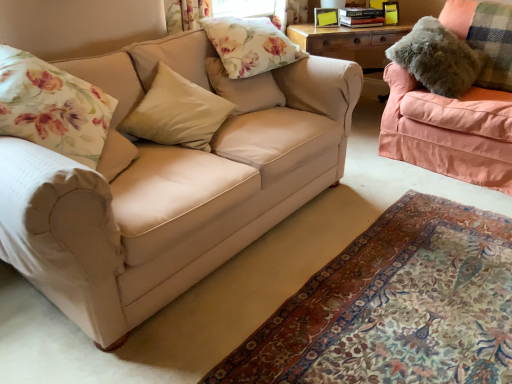
The height and width of the screenshot is (384, 512). What are the coordinates of `floral fabric pillow at upper center, marked as the second pillow in a right-to-left arrangement` in the screenshot? It's located at (244, 88).

In order to face beige fabric pillow at center, the third pillow in the right-to-left sequence, should I rotate leftwards or rightwards?

A 9.986 degree turn to the left will do.

What do you see at coordinates (395, 306) in the screenshot? The width and height of the screenshot is (512, 384). I see `beige fabric rug at lower center` at bounding box center [395, 306].

Where is `beige fabric couch at left, positioned as the first studio couch in left-to-right order`? beige fabric couch at left, positioned as the first studio couch in left-to-right order is located at coordinates (170, 201).

Is floral fabric pillow at left, placed as the fourth pillow when sorted from right to left, located within fuzzy gray pillow at upper right, acting as the first pillow starting from the right?

Actually, floral fabric pillow at left, placed as the fourth pillow when sorted from right to left, is outside fuzzy gray pillow at upper right, acting as the first pillow starting from the right.

Between fuzzy gray pillow at upper right, acting as the first pillow starting from the right, and floral fabric pillow at left, placed as the fourth pillow when sorted from right to left, which one has smaller size?

With smaller size is fuzzy gray pillow at upper right, acting as the first pillow starting from the right.

Which is more to the left, fuzzy gray pillow at upper right, acting as the first pillow starting from the right, or floral fabric pillow at left, placed as the first pillow when sorted from left to right?

Positioned to the left is floral fabric pillow at left, placed as the first pillow when sorted from left to right.

Consider the image. Is beige fabric couch at left, which appears as the 2th studio couch when viewed from the right, located outside floral fabric pillow at upper center?

That's correct, beige fabric couch at left, which appears as the 2th studio couch when viewed from the right, is outside of floral fabric pillow at upper center.

Does point (192, 36) lie in front of point (202, 20)?

Yes.

Can you confirm if beige fabric couch at left, which appears as the 2th studio couch when viewed from the right, is thinner than floral fabric pillow at upper center?

In fact, beige fabric couch at left, which appears as the 2th studio couch when viewed from the right, might be wider than floral fabric pillow at upper center.

From the image's perspective, who appears lower, beige fabric couch at left, positioned as the first studio couch in left-to-right order, or floral fabric pillow at upper center?

beige fabric couch at left, positioned as the first studio couch in left-to-right order.

Are beige fabric pillow at center, which is counted as the 2th pillow, starting from the left, and fuzzy gray pillow at upper right, arranged as the 4th pillow when viewed from the left, far apart?

Yes.

Is beige fabric pillow at center, the third pillow in the right-to-left sequence, further to camera compared to fuzzy gray pillow at upper right, acting as the first pillow starting from the right?

No, beige fabric pillow at center, the third pillow in the right-to-left sequence, is in front of fuzzy gray pillow at upper right, acting as the first pillow starting from the right.

How far apart are beige fabric pillow at center, the third pillow in the right-to-left sequence, and fuzzy gray pillow at upper right, arranged as the 4th pillow when viewed from the left?

The distance of beige fabric pillow at center, the third pillow in the right-to-left sequence, from fuzzy gray pillow at upper right, arranged as the 4th pillow when viewed from the left, is 1.48 meters.

Identify the location of the 2nd pillow behind the beige fabric pillow at center, which is counted as the 2th pillow, starting from the left. (437, 58).

Are pink fabric couch at right, which is counted as the 2th studio couch, starting from the left, and fuzzy gray pillow at upper right, arranged as the 4th pillow when viewed from the left, far apart?

No.

Does pink fabric couch at right, the first studio couch when ordered from right to left, have a greater width compared to fuzzy gray pillow at upper right, acting as the first pillow starting from the right?

Yes.

Which is less distant, (x=399, y=141) or (x=474, y=68)?

Clearly, point (x=399, y=141) is more distant from the camera than point (x=474, y=68).

Can you confirm if floral fabric pillow at upper center, marked as the second pillow in a right-to-left arrangement, is positioned to the right of floral fabric pillow at left, placed as the fourth pillow when sorted from right to left?

Indeed, floral fabric pillow at upper center, marked as the second pillow in a right-to-left arrangement, is positioned on the right side of floral fabric pillow at left, placed as the fourth pillow when sorted from right to left.

What's the angular difference between floral fabric pillow at upper center, which ranks as the third pillow in left-to-right order, and floral fabric pillow at left, placed as the fourth pillow when sorted from right to left,'s facing directions?

They differ by 48.6 degrees in their facing directions.

From a real-world perspective, between floral fabric pillow at upper center, marked as the second pillow in a right-to-left arrangement, and floral fabric pillow at left, placed as the fourth pillow when sorted from right to left, who is vertically lower?

floral fabric pillow at upper center, marked as the second pillow in a right-to-left arrangement.

From the picture: Who is smaller, floral fabric pillow at left, placed as the fourth pillow when sorted from right to left, or floral fabric pillow at upper center?

Smaller between the two is floral fabric pillow at upper center.

From a real-world perspective, is floral fabric pillow at left, placed as the first pillow when sorted from left to right, beneath floral fabric pillow at upper center?

Yes.

Is floral fabric pillow at left, placed as the fourth pillow when sorted from right to left, shorter than floral fabric pillow at upper center?

No.

Looking at this image, in the image, is floral fabric pillow at left, placed as the first pillow when sorted from left to right, positioned in front of or behind floral fabric pillow at upper center?

In the image, floral fabric pillow at left, placed as the first pillow when sorted from left to right, appears in front of floral fabric pillow at upper center.

Considering the sizes of objects fuzzy gray pillow at upper right, arranged as the 4th pillow when viewed from the left, and beige fabric couch at left, which appears as the 2th studio couch when viewed from the right, in the image provided, who is thinner, fuzzy gray pillow at upper right, arranged as the 4th pillow when viewed from the left, or beige fabric couch at left, which appears as the 2th studio couch when viewed from the right,?

With smaller width is fuzzy gray pillow at upper right, arranged as the 4th pillow when viewed from the left.

Measure the distance between fuzzy gray pillow at upper right, arranged as the 4th pillow when viewed from the left, and beige fabric couch at left, which appears as the 2th studio couch when viewed from the right.

A distance of 4.02 feet exists between fuzzy gray pillow at upper right, arranged as the 4th pillow when viewed from the left, and beige fabric couch at left, which appears as the 2th studio couch when viewed from the right.

What's the angular difference between fuzzy gray pillow at upper right, arranged as the 4th pillow when viewed from the left, and beige fabric couch at left, positioned as the first studio couch in left-to-right order,'s facing directions?

fuzzy gray pillow at upper right, arranged as the 4th pillow when viewed from the left, and beige fabric couch at left, positioned as the first studio couch in left-to-right order, are facing 94.9 degrees away from each other.

Are fuzzy gray pillow at upper right, acting as the first pillow starting from the right, and beige fabric couch at left, which appears as the 2th studio couch when viewed from the right, beside each other?

No, fuzzy gray pillow at upper right, acting as the first pillow starting from the right, is not with beige fabric couch at left, which appears as the 2th studio couch when viewed from the right.

This screenshot has height=384, width=512. In order to click on pillow that is the 3rd object located above the floral fabric pillow at left, placed as the fourth pillow when sorted from right to left (from the image's perspective) in this screenshot , I will do `click(437, 58)`.

At what (x,y) coordinates should I click in order to perform the action: click on the 2nd studio couch directly beneath the floral fabric pillow at upper center (from a real-world perspective). Please return your answer as a coordinate pair (x, y). Looking at the image, I should click on (170, 201).

When comparing their distances from floral fabric pillow at upper center, marked as the second pillow in a right-to-left arrangement, does beige fabric rug at lower center or beige fabric couch at left, which appears as the 2th studio couch when viewed from the right, seem closer?

Based on the image, beige fabric couch at left, which appears as the 2th studio couch when viewed from the right, appears to be nearer to floral fabric pillow at upper center, marked as the second pillow in a right-to-left arrangement.

When comparing their distances from floral fabric pillow at upper center, does fuzzy gray pillow at upper right, acting as the first pillow starting from the right, or floral fabric pillow at left, placed as the fourth pillow when sorted from right to left, seem closer?

The object closer to floral fabric pillow at upper center is floral fabric pillow at left, placed as the fourth pillow when sorted from right to left.

Considering their positions, is beige fabric pillow at center, which is counted as the 2th pillow, starting from the left, positioned further to floral fabric pillow at upper center than floral fabric pillow at upper center, which ranks as the third pillow in left-to-right order?

The object further to floral fabric pillow at upper center is beige fabric pillow at center, which is counted as the 2th pillow, starting from the left.

Based on the photo, considering their positions, is beige fabric pillow at center, which is counted as the 2th pillow, starting from the left, positioned further to pink fabric couch at right, the first studio couch when ordered from right to left, than fuzzy gray pillow at upper right, acting as the first pillow starting from the right?

beige fabric pillow at center, which is counted as the 2th pillow, starting from the left.

Which object lies nearer to the anchor point fuzzy gray pillow at upper right, acting as the first pillow starting from the right, floral fabric pillow at left, placed as the fourth pillow when sorted from right to left, or beige fabric couch at left, which appears as the 2th studio couch when viewed from the right?

beige fabric couch at left, which appears as the 2th studio couch when viewed from the right, lies closer to fuzzy gray pillow at upper right, acting as the first pillow starting from the right, than the other object.

Estimate the real-world distances between objects in this image. Which object is closer to floral fabric pillow at upper center, which ranks as the third pillow in left-to-right order, beige fabric couch at left, positioned as the first studio couch in left-to-right order, or floral fabric pillow at left, placed as the first pillow when sorted from left to right?

The object closer to floral fabric pillow at upper center, which ranks as the third pillow in left-to-right order, is beige fabric couch at left, positioned as the first studio couch in left-to-right order.

From the picture: When comparing their distances from beige fabric pillow at center, which is counted as the 2th pillow, starting from the left, does pink fabric couch at right, the first studio couch when ordered from right to left, or beige fabric couch at left, positioned as the first studio couch in left-to-right order, seem further?

Among the two, pink fabric couch at right, the first studio couch when ordered from right to left, is located further to beige fabric pillow at center, which is counted as the 2th pillow, starting from the left.

Based on their spatial positions, is floral fabric pillow at left, placed as the fourth pillow when sorted from right to left, or beige fabric couch at left, positioned as the first studio couch in left-to-right order, closer to pink fabric couch at right, the first studio couch when ordered from right to left?

beige fabric couch at left, positioned as the first studio couch in left-to-right order.

I want to click on flower between beige fabric pillow at center, which is counted as the 2th pillow, starting from the left, and fuzzy gray pillow at upper right, arranged as the 4th pillow when viewed from the left, from left to right, so click(250, 45).

Identify the location of plain situated between beige fabric pillow at center, the third pillow in the right-to-left sequence, and fuzzy gray pillow at upper right, acting as the first pillow starting from the right, from left to right. (395, 306).

Identify the location of studio couch between floral fabric pillow at left, placed as the fourth pillow when sorted from right to left, and pink fabric couch at right, which is counted as the 2th studio couch, starting from the left. The height and width of the screenshot is (384, 512). (170, 201).

The width and height of the screenshot is (512, 384). What are the coordinates of `plain between beige fabric couch at left, positioned as the first studio couch in left-to-right order, and pink fabric couch at right, the first studio couch when ordered from right to left` in the screenshot? It's located at (395, 306).